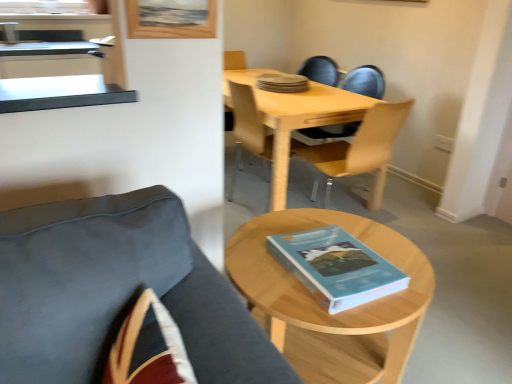
Question: Does velvet dark blue chair at lower left, placed as the first chair when sorted from front to back, have a lesser width compared to blue matte book at center, which ranks as the second book in back-to-front order?

Choices:
 (A) yes
 (B) no

Answer: (A)

Question: Considering the relative positions of velvet dark blue chair at lower left, placed as the first chair when sorted from front to back, and blue matte book at center, which ranks as the second book in back-to-front order, in the image provided, is velvet dark blue chair at lower left, placed as the first chair when sorted from front to back, in front of blue matte book at center, which ranks as the second book in back-to-front order,?

Choices:
 (A) yes
 (B) no

Answer: (A)

Question: Considering the relative positions of velvet dark blue chair at lower left, placed as the first chair when sorted from front to back, and blue matte book at center, which ranks as the second book in back-to-front order, in the image provided, is velvet dark blue chair at lower left, placed as the first chair when sorted from front to back, to the left of blue matte book at center, which ranks as the second book in back-to-front order, from the viewer's perspective?

Choices:
 (A) yes
 (B) no

Answer: (A)

Question: Considering the relative sizes of velvet dark blue chair at lower left, the 3th chair positioned from the back, and blue matte book at center, the 1th book positioned from the front, in the image provided, is velvet dark blue chair at lower left, the 3th chair positioned from the back, smaller than blue matte book at center, the 1th book positioned from the front,?

Choices:
 (A) yes
 (B) no

Answer: (B)

Question: Considering the relative sizes of velvet dark blue chair at lower left, placed as the first chair when sorted from front to back, and blue matte book at center, the 1th book positioned from the front, in the image provided, is velvet dark blue chair at lower left, placed as the first chair when sorted from front to back, shorter than blue matte book at center, the 1th book positioned from the front,?

Choices:
 (A) no
 (B) yes

Answer: (A)

Question: From a real-world perspective, is wooden picture frame at upper center above or below velvet dark blue chair at lower left, the 3th chair positioned from the back?

Choices:
 (A) below
 (B) above

Answer: (B)

Question: From the image's perspective, relative to velvet dark blue chair at lower left, placed as the first chair when sorted from front to back, is wooden picture frame at upper center above or below?

Choices:
 (A) above
 (B) below

Answer: (A)

Question: Does point (167, 23) appear closer or farther from the camera than point (266, 382)?

Choices:
 (A) farther
 (B) closer

Answer: (A)

Question: Is wooden picture frame at upper center wider or thinner than velvet dark blue chair at lower left, placed as the first chair when sorted from front to back?

Choices:
 (A) wide
 (B) thin

Answer: (B)

Question: Considering their positions, is light wood/wooden table at center located in front of or behind light wood/woodenobject at lower right?

Choices:
 (A) behind
 (B) front

Answer: (A)

Question: Is light wood/wooden table at center taller or shorter than light wood/woodenobject at lower right?

Choices:
 (A) tall
 (B) short

Answer: (A)

Question: In terms of width, does light wood/wooden table at center look wider or thinner when compared to light wood/woodenobject at lower right?

Choices:
 (A) wide
 (B) thin

Answer: (A)

Question: From a real-world perspective, is light wood/wooden table at center above or below light wood/woodenobject at lower right?

Choices:
 (A) above
 (B) below

Answer: (A)

Question: Considering the relative positions of light wood/transparent plastic chair at center, positioned as the third chair in front-to-back order, and blue matte book at center, which ranks as the second book in top-to-bottom order, in the image provided, is light wood/transparent plastic chair at center, positioned as the third chair in front-to-back order, to the left or to the right of blue matte book at center, which ranks as the second book in top-to-bottom order,?

Choices:
 (A) right
 (B) left

Answer: (B)

Question: From a real-world perspective, relative to blue matte book at center, the 1th book positioned from the front, is light wood/transparent plastic chair at center, the first chair in the back-to-front sequence, vertically above or below?

Choices:
 (A) above
 (B) below

Answer: (B)